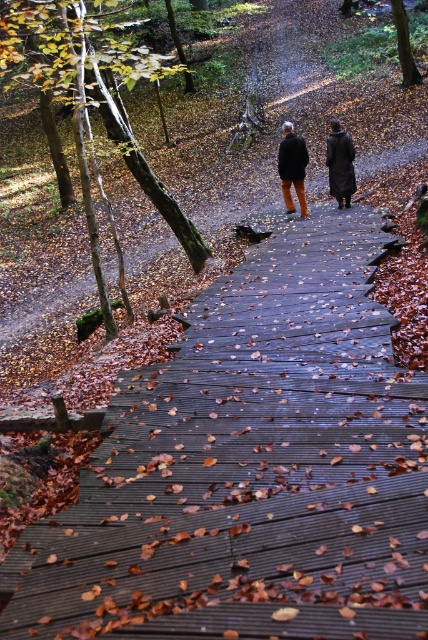
Where is the dark brown leather coat at center located in the image?

The dark brown leather coat at center is located at point (339,163) in the image.

You are standing on the wooden boardwalk in the autumn forest scene. You notice two points marked on the boardwalk. The first point is at coordinates point (294, 157) and the second is at point (344, 173). Which point is closer to you?

Point (294, 157) is closer to the camera than point (344, 173). Therefore, the first point is closer to you.